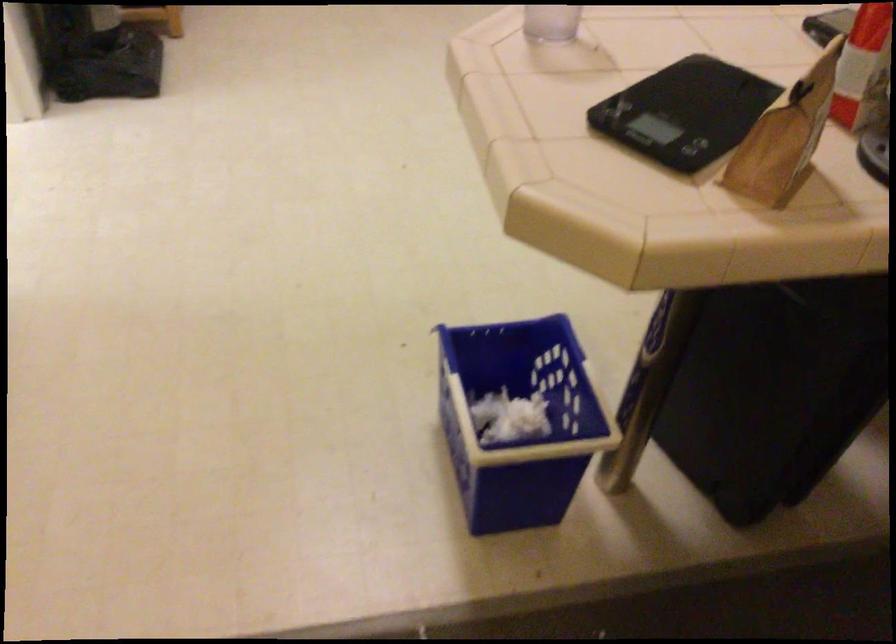
What are the coordinates of `clear plastic cup` in the screenshot? It's located at (550, 23).